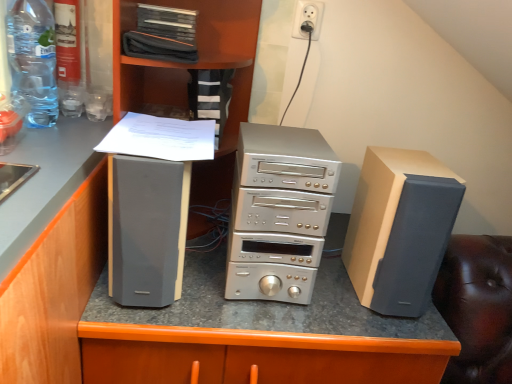
Identify the location of free location in front of matte gray speaker at left. The image size is (512, 384). (141, 320).